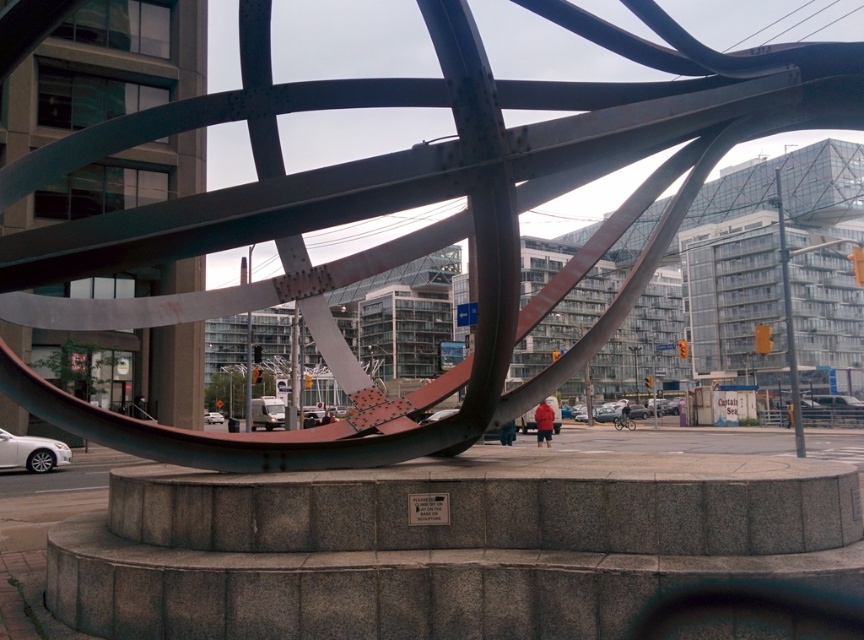
Question: Is the position of polished steel sculpture at center more distant than that of denim jacket at center?

Choices:
 (A) yes
 (B) no

Answer: (A)

Question: Does polished steel sculpture at center have a lesser width compared to red matte jacket at center?

Choices:
 (A) no
 (B) yes

Answer: (B)

Question: Which object appears farthest from the camera in this image?

Choices:
 (A) denim jacket at center
 (B) polished steel sculpture at center
 (C) red matte jacket at center

Answer: (B)

Question: Which object is farther from the camera taking this photo?

Choices:
 (A) denim jacket at center
 (B) polished steel sculpture at center

Answer: (B)

Question: Which is nearer to the denim jacket at center?

Choices:
 (A) red matte jacket at center
 (B) polished steel sculpture at center

Answer: (A)

Question: Does red matte jacket at center have a larger size compared to denim jacket at center?

Choices:
 (A) yes
 (B) no

Answer: (A)